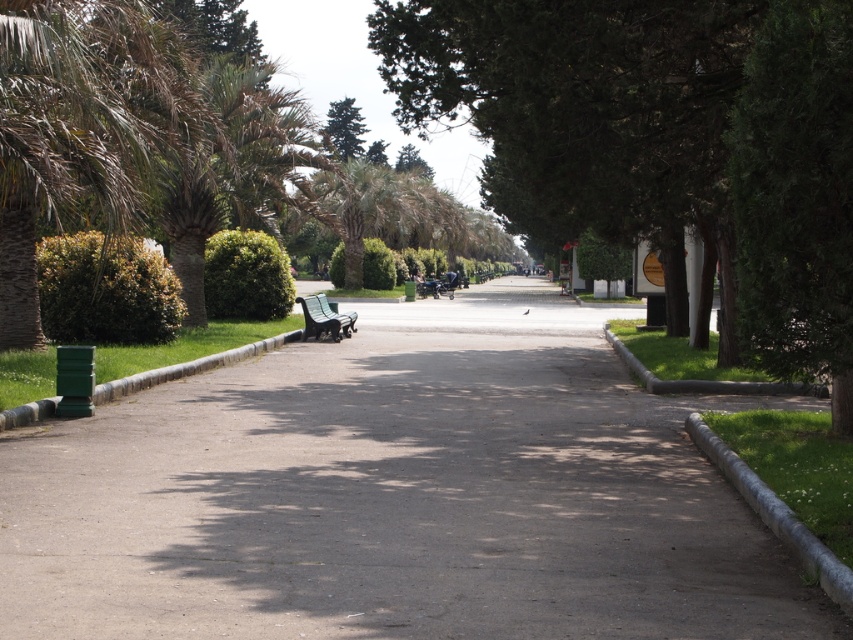
How distant is gray asphalt pavement at center from green plastic bench at center?

8.74 meters

Can you confirm if gray asphalt pavement at center is positioned below green plastic bench at center?

Yes, gray asphalt pavement at center is below green plastic bench at center.

You are a GUI agent. You are given a task and a screenshot of the screen. Output one action in this format:
    pyautogui.click(x=<x>, y=<y>)
    Task: Click on the gray asphalt pavement at center
    
    Given the screenshot: What is the action you would take?
    pyautogui.click(x=397, y=496)

Locate an element on the screen. The height and width of the screenshot is (640, 853). gray asphalt pavement at center is located at coordinates (397, 496).

Looking at this image, can you confirm if green leafy tree at center is taller than green plastic bench at center?

Indeed, green leafy tree at center has a greater height compared to green plastic bench at center.

Does green leafy tree at center appear over green plastic bench at center?

Correct, green leafy tree at center is located above green plastic bench at center.

Locate an element on the screen. green leafy tree at center is located at coordinates (663, 144).

Which of these two, gray asphalt pavement at center or green leafy tree at center, stands shorter?

gray asphalt pavement at center

Does gray asphalt pavement at center have a lesser height compared to green leafy tree at center?

Correct, gray asphalt pavement at center is not as tall as green leafy tree at center.

This screenshot has width=853, height=640. What do you see at coordinates (397, 496) in the screenshot?
I see `gray asphalt pavement at center` at bounding box center [397, 496].

I want to click on gray asphalt pavement at center, so click(397, 496).